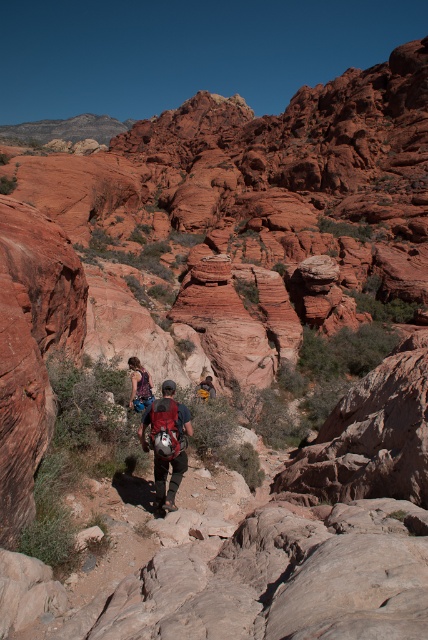
You are a hiker trying to locate your matte red backpack at center. According to the coordinates provided, where exactly would you find it in the image?

The matte red backpack at center is located at coordinates point [168,442] in the image.

You are a hiker trying to navigate the rocky trail. You notice two points on the trail marked as point (x=166, y=385) and point (x=210, y=380). Which point should you step on first if you want to move forward along the trail?

You should step on point (x=166, y=385) first because it is closer to the camera, which means it is the first point you encounter as you move forward along the trail.

You are a hiker who wants to grab your items quickly. You see a matte red backpack at center and a denim jacket at center. Which one is located to the right side of the other?

The matte red backpack at center is to the right of the denim jacket at center.